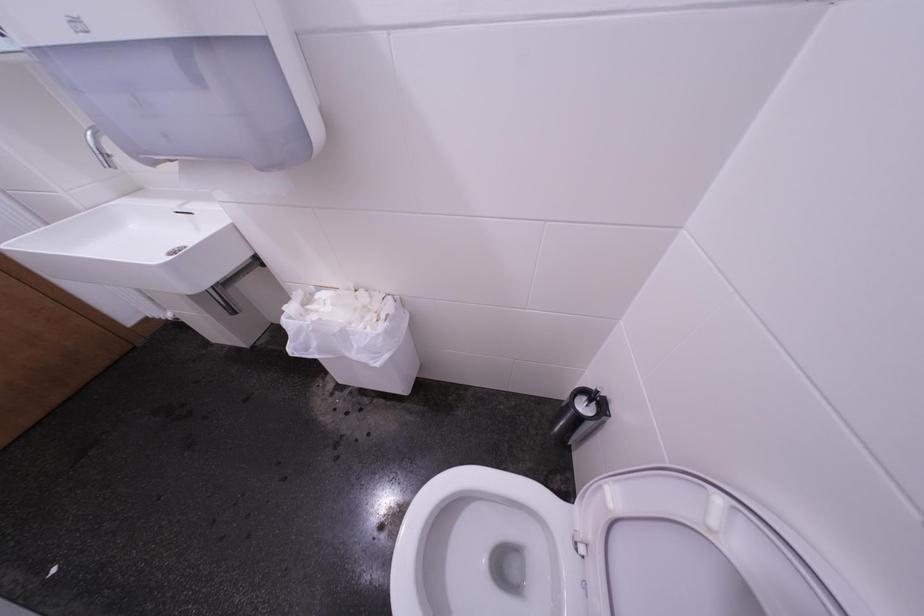
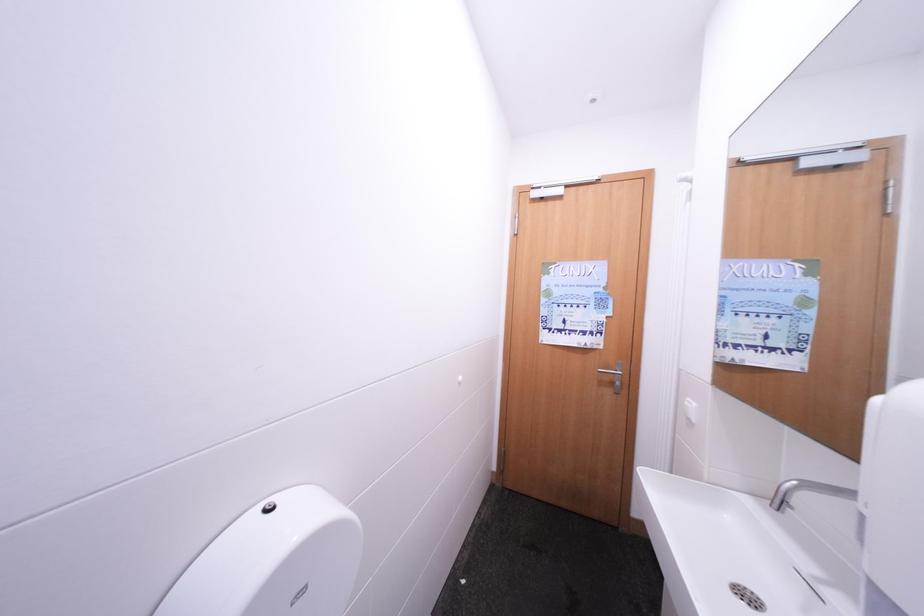
Question: How did the camera likely rotate?

Choices:
 (A) Left
 (B) Right
 (C) Up
 (D) Down

Answer: (A)